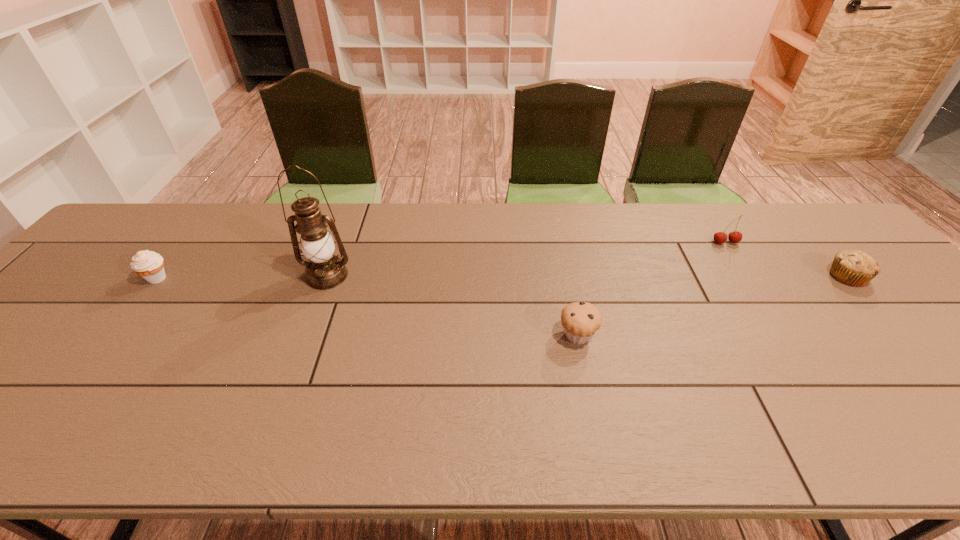
Where is `free space located 0.130m on the right of the leftmost muffin`? The image size is (960, 540). free space located 0.130m on the right of the leftmost muffin is located at coordinates (219, 278).

This screenshot has width=960, height=540. Find the location of `vacant region located 0.270m on the back of the nearest muffin`. vacant region located 0.270m on the back of the nearest muffin is located at coordinates (560, 251).

Where is `vacant space positioned 0.260m on the left of the rightmost muffin`? Image resolution: width=960 pixels, height=540 pixels. vacant space positioned 0.260m on the left of the rightmost muffin is located at coordinates (732, 276).

This screenshot has width=960, height=540. I want to click on object at the far edge, so click(x=720, y=237).

Locate an element on the screen. The height and width of the screenshot is (540, 960). object that is at the right edge is located at coordinates (855, 268).

Locate an element on the screen. The width and height of the screenshot is (960, 540). vacant space at the far edge is located at coordinates (581, 245).

In order to click on blank space at the near edge in this screenshot , I will do `click(22, 440)`.

Where is `vacant space at the left edge of the desktop`? This screenshot has width=960, height=540. vacant space at the left edge of the desktop is located at coordinates (63, 310).

In the image, there is a desktop. Identify the location of vacant space at the right edge. (931, 348).

Locate an element on the screen. vacant area at the far right corner is located at coordinates (812, 220).